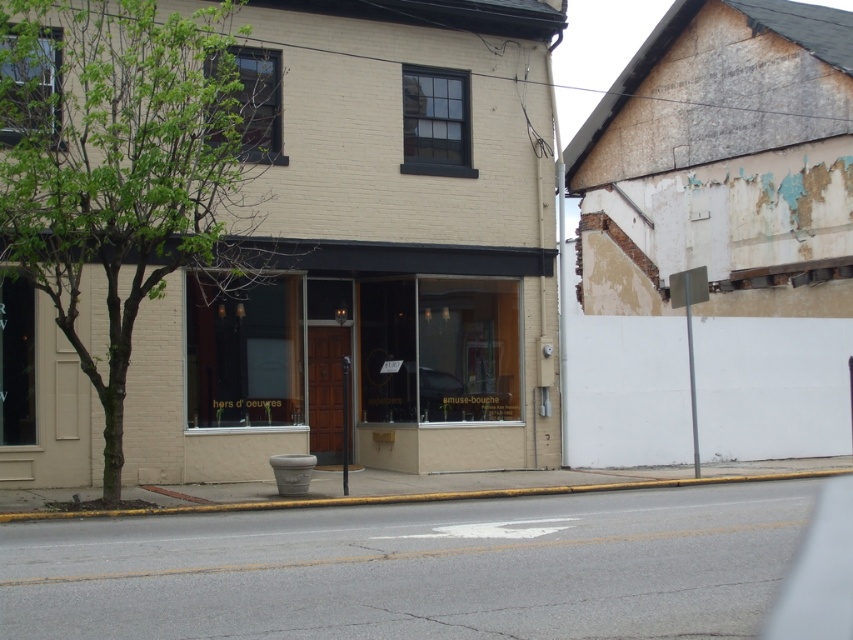
You are a delivery person trying to park your 2.5 meter tall delivery robot. You need to ensure there is enough vertical clearance between the green leafy tree at left and the yellow concrete curb at lower center. Can the robot fit vertically between them?

The green leafy tree at left is taller than the yellow concrete curb at lower center, so there is enough vertical clearance for the 2.5 meter tall delivery robot to fit between them.

Consider the image. You are a delivery person trying to find the entrance to the matte glass storefront at center. Based on the scene description, where should you look relative to the building on the left?

The matte glass storefront at center is located at point coordinates of 0.561 on the x axis and 0.445 on the y axis, so you should look towards the central area of the building on the left where the entrance is likely positioned.

You are a delivery person trying to park your 1.8 meters wide delivery cart between the matte glass storefront at center and the yellow concrete curb at lower center. Can your cart fit in the space between them?

The matte glass storefront at center is narrower than the yellow concrete curb at lower center. However, the description only provides information about their widths, not the distance between them. Without knowing the actual space between the two objects, it is impossible to determine if the cart will fit.